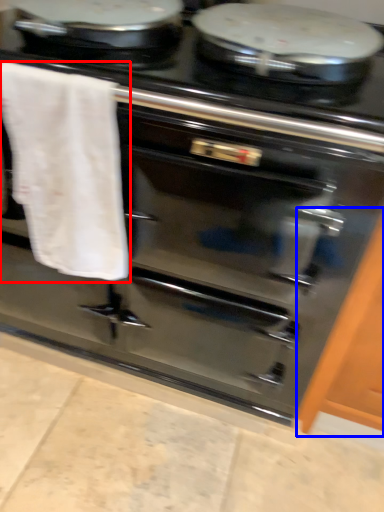
Question: Which of the following is the farthest to the observer, bath towel (highlighted by a red box) or cabinetry (highlighted by a blue box)?

Choices:
 (A) bath towel
 (B) cabinetry

Answer: (B)